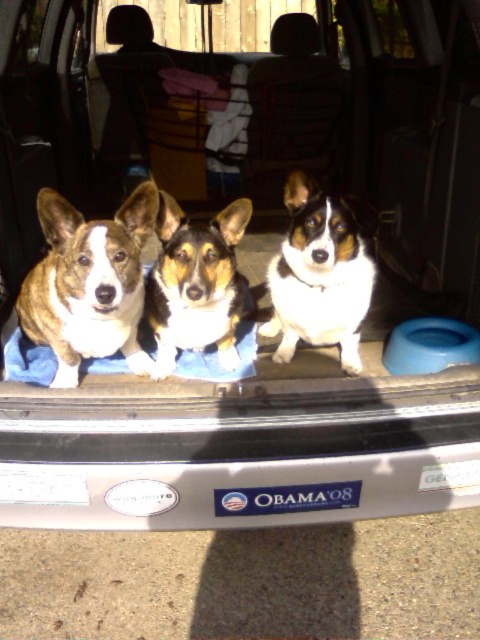
Question: Which object is closer to the camera taking this photo?

Choices:
 (A) white fur dog at center
 (B) brown and white fur dog at center
 (C) brown and white fur at center

Answer: (B)

Question: Does brown and white fur dog at center appear on the left side of brown and white fur at center?

Choices:
 (A) yes
 (B) no

Answer: (A)

Question: Which point is farther from the camera taking this photo?

Choices:
 (A) (337, 224)
 (B) (157, 353)

Answer: (B)

Question: Which object appears closest to the camera in this image?

Choices:
 (A) brown and white fur dog at center
 (B) white fur dog at center
 (C) brown and white fur at center

Answer: (A)

Question: Is white fur dog at center positioned behind brown and white fur at center?

Choices:
 (A) yes
 (B) no

Answer: (A)

Question: Is the position of brown and white fur dog at center more distant than that of brown and white fur at center?

Choices:
 (A) yes
 (B) no

Answer: (B)